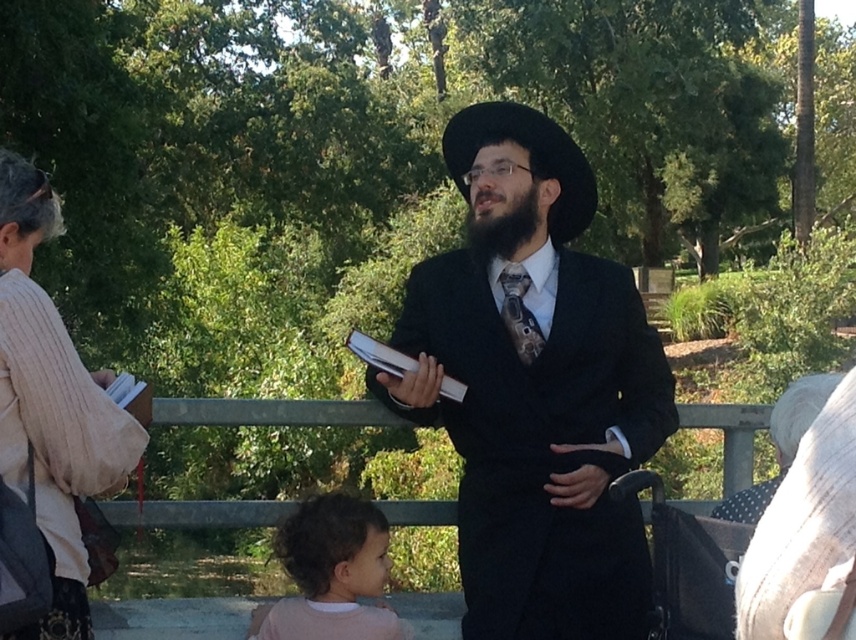
You are a photographer trying to capture a clear shot of both the curly hair at lower left and the dark gray textured tie at center. Since you can only focus on one subject at a time, which one should you choose to ensure the other appears in the background?

You should focus on the curly hair at lower left because it is closer to you than the dark gray textured tie at center, so the tie will be in the background when the hair is in focus.

You are a costume designer preparing for a play. You need to ensure that the matte black suit at center and the black felt hat at center fit together proportionally. Based on the scene, which of these two items has a greater width?

The matte black suit at center has a greater width than the black felt hat at center, as stated in the description.

You are taking a photo of the scene and want to focus on both the man in the center and the person on the left. Which of the two points, point [637,380] or point [532,138], is closer to the camera?

Point [532,138] is closer to the camera than point [637,380].